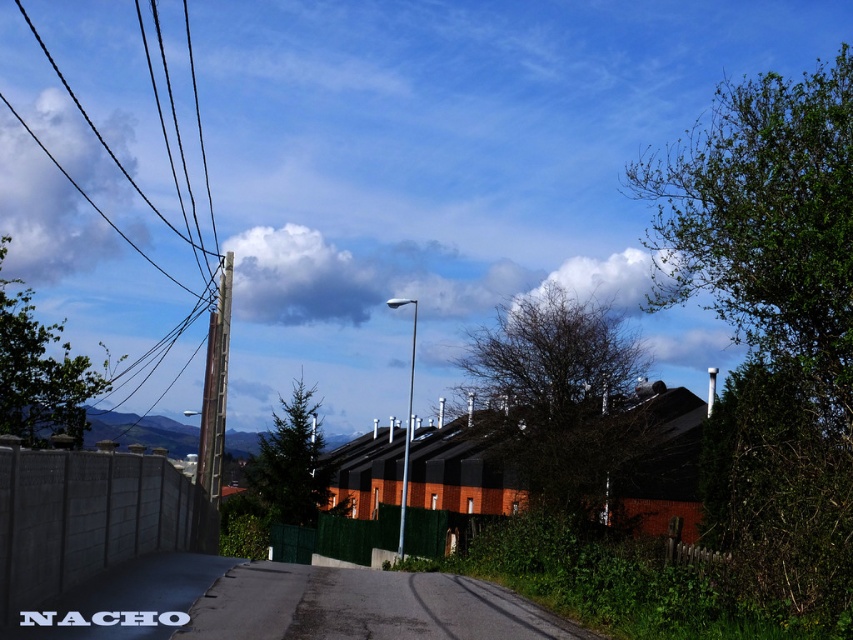
Measure the distance between concrete fence at lower left and camera.

6.73 meters

Where is `concrete fence at lower left`? The image size is (853, 640). concrete fence at lower left is located at coordinates (86, 516).

Can you confirm if concrete fence at lower left is positioned below white fluffy cloud at upper left?

Correct, concrete fence at lower left is located below white fluffy cloud at upper left.

Is point (123, 509) positioned behind point (91, 205)?

No, (123, 509) is closer to viewer.

Who is more distant from viewer, (120, 468) or (20, 122)?

The point (20, 122) is more distant.

Where is `concrete fence at lower left`? This screenshot has width=853, height=640. concrete fence at lower left is located at coordinates (86, 516).

Between brown wooden pole at left and silver metallic pole at center, which one is positioned higher?

brown wooden pole at left is above.

Can you confirm if brown wooden pole at left is wider than silver metallic pole at center?

Indeed, brown wooden pole at left has a greater width compared to silver metallic pole at center.

Is point (178, 333) behind point (409, 428)?

Yes.

Find the location of a particular element. brown wooden pole at left is located at coordinates click(166, 157).